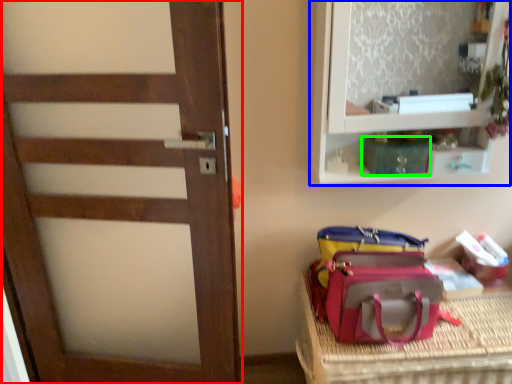
Question: Based on their relative distances, which object is farther from door (highlighted by a red box)? Choose from shelf (highlighted by a blue box) and kit (highlighted by a green box).

Choices:
 (A) shelf
 (B) kit

Answer: (B)